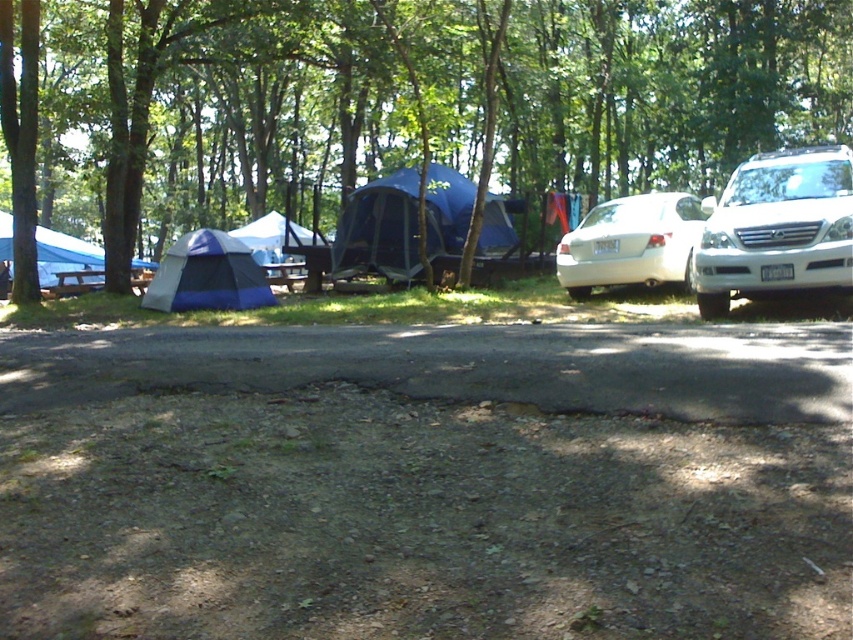
You are a hiker who wants to park your car near the blue mesh tent at center. You see the white glossy sedan at right. Is the sedan in a good spot to park your car near the tent?

The blue mesh tent at center is to the left of the white glossy sedan at right. Since the sedan is parked to the right of the tent, it is already positioned near the tent, so parking there would be a good spot.

You are planning to set up a new tent in the camping area. You have a tent that is 2 meters wide. The blue mesh tent at center is already there. Can your new tent fit in the space next to the white glossy sedan at right without overlapping?

The blue mesh tent at center has a larger width than the white glossy sedan at right. Since your tent is 2 meters wide, it depends on the available space next to the sedan. However, since the blue mesh tent is wider, there might be sufficient space. Please measure the exact dimensions before setting up.

You are a hiker planning to park your car, the white glossy sedan at right, near the blue mesh tent at center. Considering their sizes, will the sedan fit under the tent without touching the roof?

The blue mesh tent at center is taller than the white glossy sedan at right, so yes, the sedan can fit under the tent without touching the roof.